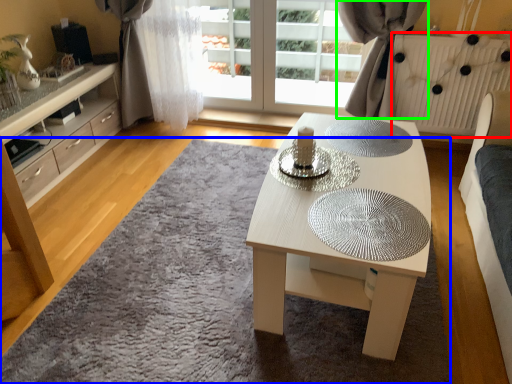
Question: Which object is positioned closest to radiator (highlighted by a red box)? Select from mat (highlighted by a blue box) and curtain (highlighted by a green box).

Choices:
 (A) mat
 (B) curtain

Answer: (B)